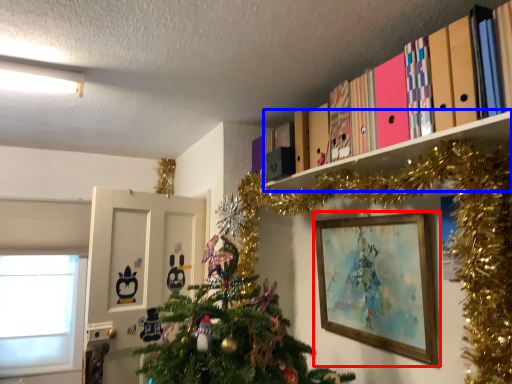
Question: Which of the following is the farthest to the observer, picture frame (highlighted by a red box) or shelf (highlighted by a blue box)?

Choices:
 (A) picture frame
 (B) shelf

Answer: (A)